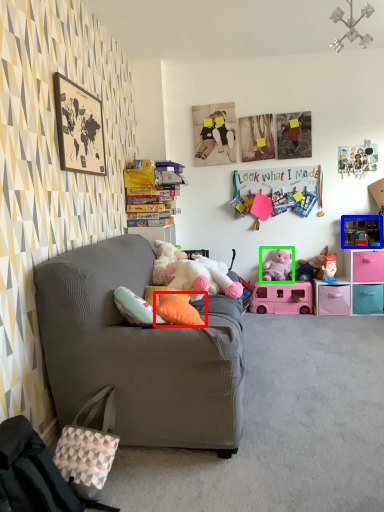
Question: Which object is positioned closest to pillow (highlighted by a red box)? Select from toy (highlighted by a blue box) and toy (highlighted by a green box).

Choices:
 (A) toy
 (B) toy

Answer: (B)